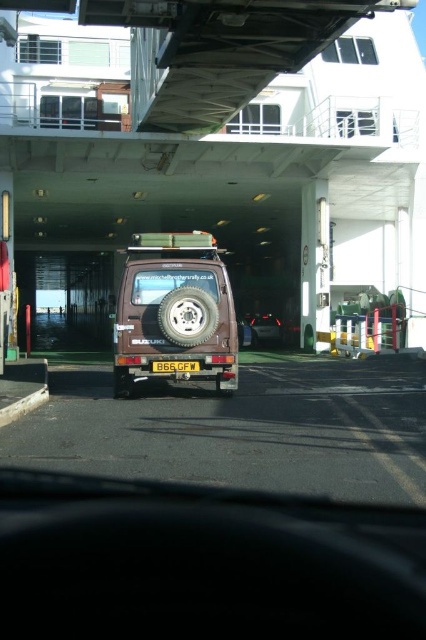
Between matte brown van at center and yellow matte license plate at center, which one appears on the right side from the viewer's perspective?

matte brown van at center

Is matte brown van at center to the right of yellow matte license plate at center from the viewer's perspective?

Yes, matte brown van at center is to the right of yellow matte license plate at center.

The width and height of the screenshot is (426, 640). I want to click on matte brown van at center, so click(x=262, y=328).

Who is shorter, brown matte jeep at center or yellow matte license plate at center?

Standing shorter between the two is yellow matte license plate at center.

Between point (114, 385) and point (169, 362), which one is positioned behind?

Point (114, 385)

You are a GUI agent. You are given a task and a screenshot of the screen. Output one action in this format:
    pyautogui.click(x=<x>, y=<y>)
    Task: Click on the brown matte jeep at center
    Image resolution: width=426 pixels, height=640 pixels.
    Given the screenshot: What is the action you would take?
    pyautogui.click(x=175, y=310)

Does brown matte jeep at center appear over matte brown van at center?

Yes.

This screenshot has width=426, height=640. What do you see at coordinates (175, 310) in the screenshot? I see `brown matte jeep at center` at bounding box center [175, 310].

Is point (166, 298) less distant than point (256, 317)?

Yes, point (166, 298) is in front of point (256, 317).

The height and width of the screenshot is (640, 426). What are the coordinates of `brown matte jeep at center` in the screenshot? It's located at (175, 310).